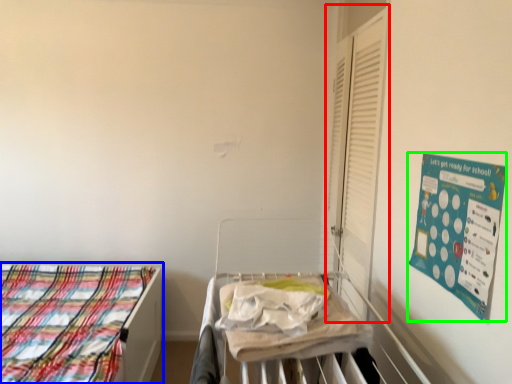
Question: Which is nearer to the shutter (highlighted by a red box)? bed (highlighted by a blue box) or poster (highlighted by a green box).

Choices:
 (A) bed
 (B) poster

Answer: (B)